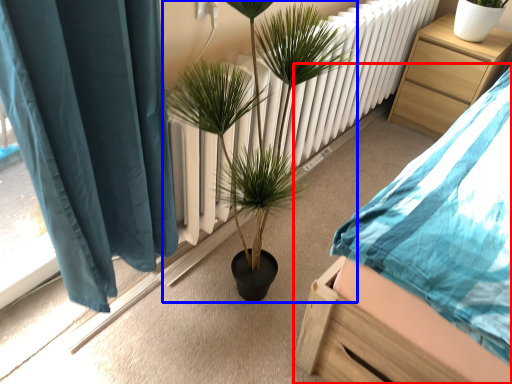
Question: Which of the following is the closest to the observer, bed (highlighted by a red box) or houseplant (highlighted by a blue box)?

Choices:
 (A) bed
 (B) houseplant

Answer: (A)